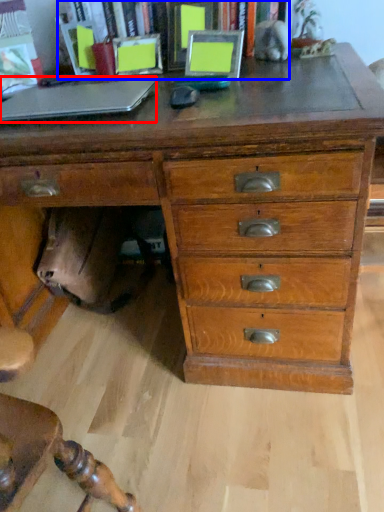
Question: Among these objects, which one is farthest to the camera, laptop (highlighted by a red box) or bookcase (highlighted by a blue box)?

Choices:
 (A) laptop
 (B) bookcase

Answer: (B)